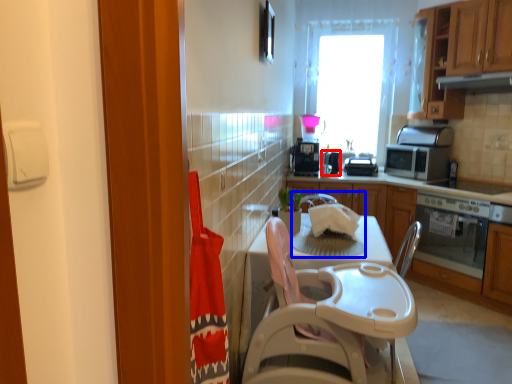
Question: Which point is further to the camera, appliance (highlighted by a red box) or sink (highlighted by a blue box)?

Choices:
 (A) appliance
 (B) sink

Answer: (A)